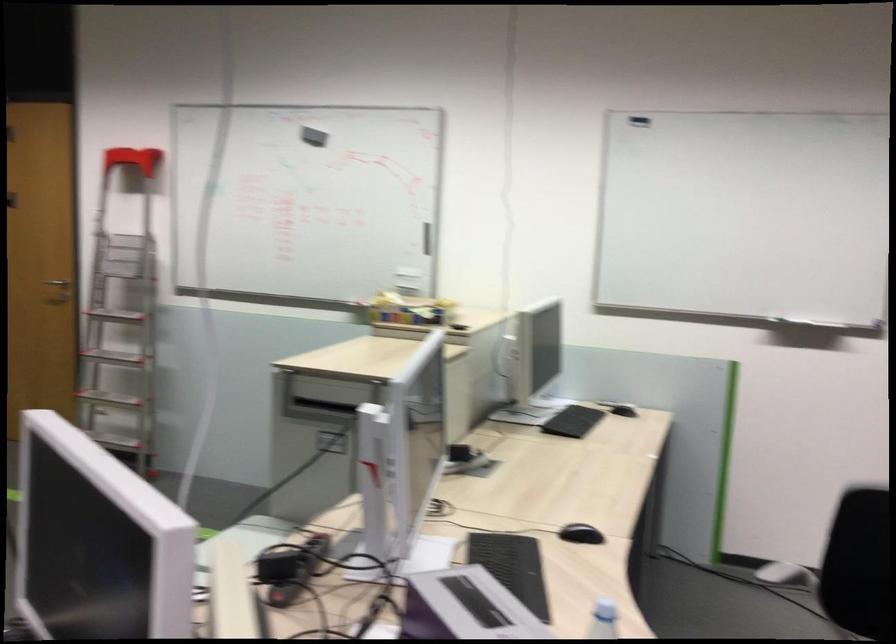
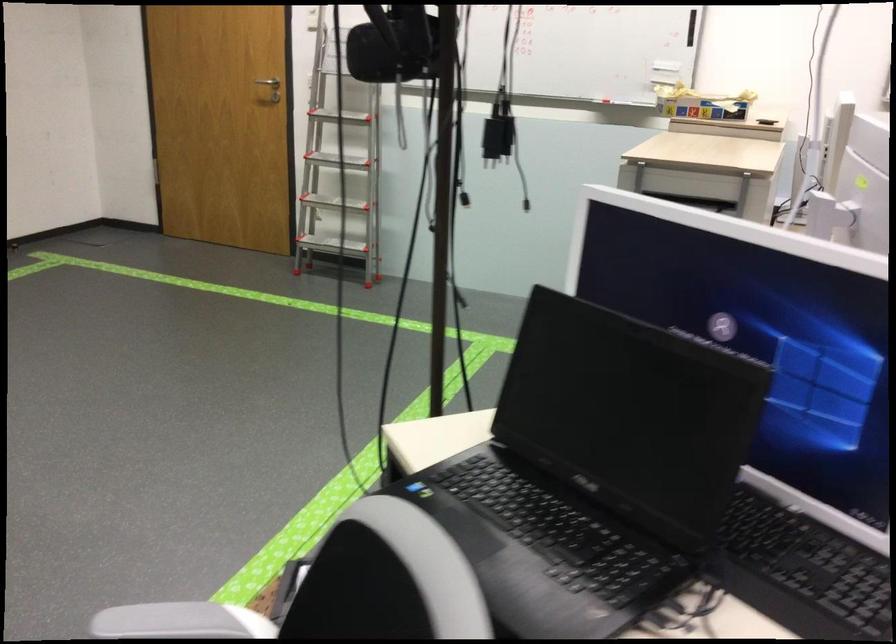
Question: The first image is from the beginning of the video and the second image is from the end. How did the camera likely rotate when shooting the video?

Choices:
 (A) Left
 (B) Right
 (C) Up
 (D) Down

Answer: (D)